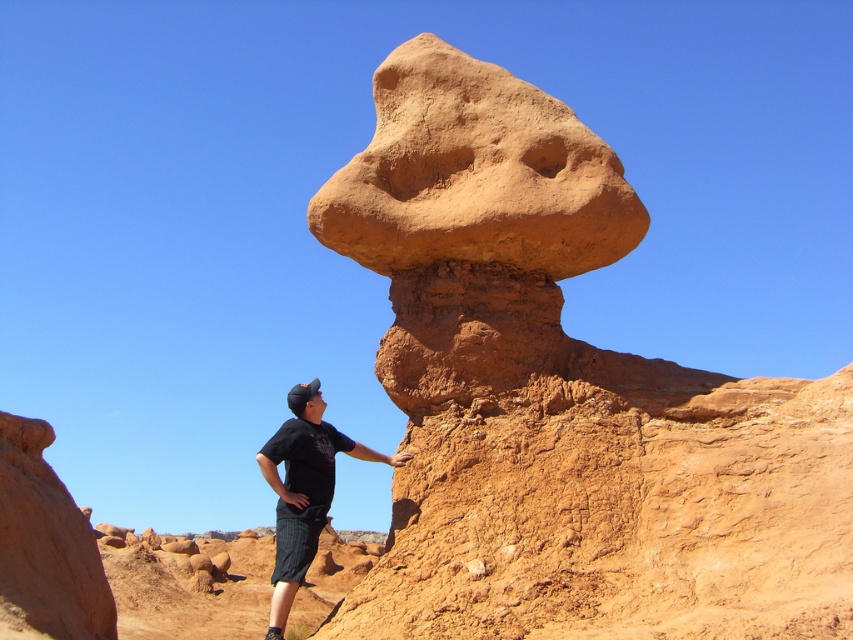
Question: Which point is farther to the camera?

Choices:
 (A) (311, 392)
 (B) (460, 452)

Answer: (A)

Question: From the image, what is the correct spatial relationship of rustic sandstone mushroom at center in relation to black cotton shirt at center?

Choices:
 (A) above
 (B) below

Answer: (A)

Question: Which point is closer to the camera?

Choices:
 (A) (281, 536)
 (B) (796, 435)

Answer: (A)

Question: Can you confirm if rustic sandstone mushroom at center is thinner than black cotton shirt at center?

Choices:
 (A) no
 (B) yes

Answer: (A)

Question: Where is rustic sandstone mushroom at center located in relation to black cotton shirt at center in the image?

Choices:
 (A) left
 (B) right

Answer: (B)